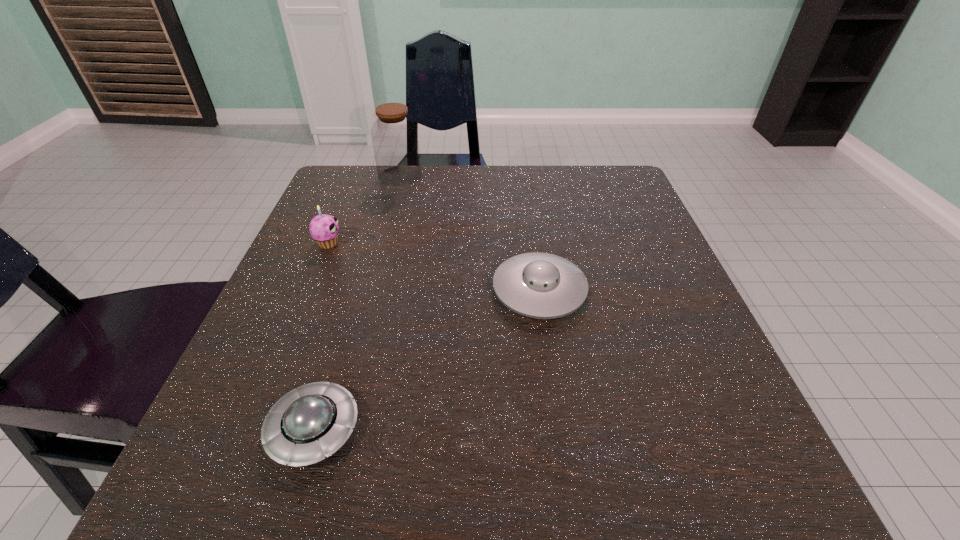
Locate an element on the screen. The height and width of the screenshot is (540, 960). free location located 0.220m on the back of the right saucer is located at coordinates (526, 200).

I want to click on free region located 0.240m on the back of the nearest object, so click(x=359, y=279).

Locate an element on the screen. The height and width of the screenshot is (540, 960). object positioned at the far edge is located at coordinates 394,136.

The height and width of the screenshot is (540, 960). I want to click on object that is at the near edge, so click(x=307, y=424).

I want to click on jar that is at the left edge, so click(394, 136).

At what (x,y) coordinates should I click in order to perform the action: click on cupcake located at the left edge. Please return your answer as a coordinate pair (x, y). The width and height of the screenshot is (960, 540). Looking at the image, I should click on (324, 229).

Locate an element on the screen. This screenshot has width=960, height=540. saucer at the left edge is located at coordinates (307, 424).

Find the location of a particular element. object that is positioned at the far left corner is located at coordinates (394, 136).

The width and height of the screenshot is (960, 540). Identify the location of object that is positioned at the near left corner. (307, 424).

What are the coordinates of `vacant space at the far edge of the desktop` in the screenshot? It's located at (544, 176).